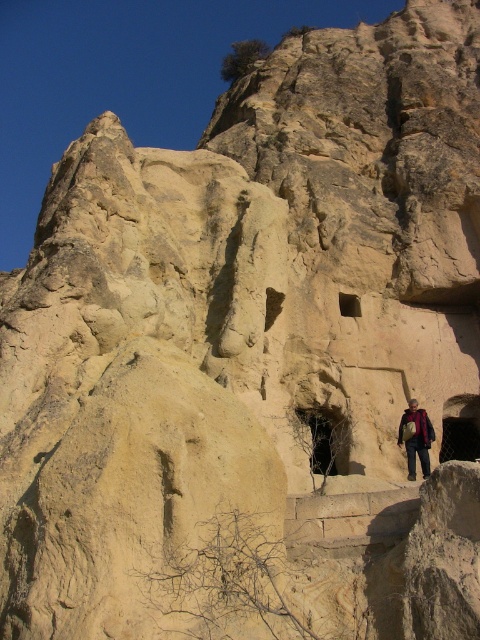
You are a photographer trying to capture both the dark brown leather jacket at lower center and the brown textured jacket at lower right in the same frame. Based on their positions, which jacket is closer to the left edge of your camera view?

The brown textured jacket at lower right is closer to the left edge of your camera view because the dark brown leather jacket at lower center is positioned to its right.

You are a hiker who wants to take a photo with both the dark brown leather jacket at lower center and the brown textured jacket at lower right in the frame. Which jacket should you position closer to the camera to ensure both are visible clearly?

You should position the dark brown leather jacket at lower center closer to the camera because it is larger in size compared to the brown textured jacket at lower right, ensuring both jackets appear balanced in the photo.